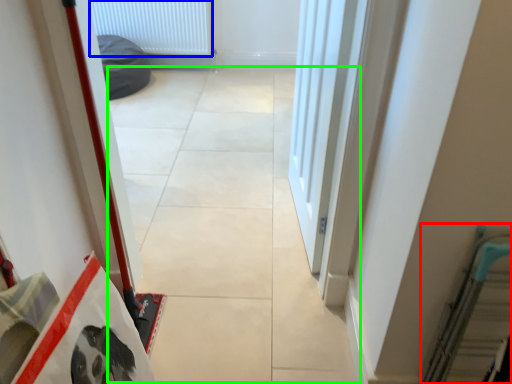
Question: Based on their relative distances, which object is nearer to escalator (highlighted by a red box)? Choose from radiator (highlighted by a blue box) and concrete (highlighted by a green box).

Choices:
 (A) radiator
 (B) concrete

Answer: (B)